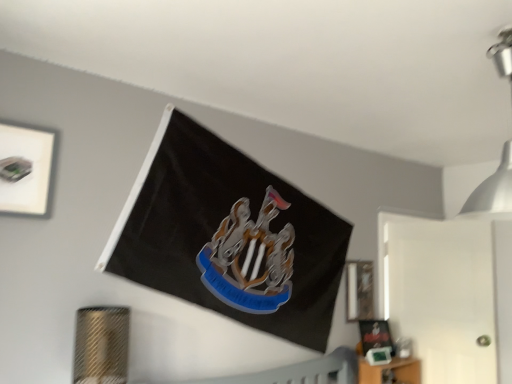
Question: From a real-world perspective, is metallic silver light fixture at upper right positioned under matte black picture frame at lower right, the second picture frame from the back, based on gravity?

Choices:
 (A) no
 (B) yes

Answer: (A)

Question: Could you tell me if metallic silver light fixture at upper right is facing matte black picture frame at lower right, which is the 2th picture frame from front to back?

Choices:
 (A) no
 (B) yes

Answer: (A)

Question: Is metallic silver light fixture at upper right next to matte black picture frame at lower right, which appears as the third picture frame when viewed from the left, and touching it?

Choices:
 (A) no
 (B) yes

Answer: (A)

Question: Is metallic silver light fixture at upper right outside matte black picture frame at lower right, which is the 2th picture frame from front to back?

Choices:
 (A) yes
 (B) no

Answer: (A)

Question: Does metallic silver light fixture at upper right have a smaller size compared to matte black picture frame at lower right, marked as the 1th picture frame in a bottom-to-top arrangement?

Choices:
 (A) yes
 (B) no

Answer: (B)

Question: Is metallic silver light fixture at upper right to the left of matte black picture frame at lower right, which appears as the third picture frame when viewed from the left, from the viewer's perspective?

Choices:
 (A) no
 (B) yes

Answer: (A)

Question: Is matte black picture frame at lower right, which appears as the third picture frame when viewed from the left, bigger than matte black picture frame at right, the 2th picture frame ordered from the bottom?

Choices:
 (A) yes
 (B) no

Answer: (A)

Question: Considering the relative sizes of matte black picture frame at lower right, marked as the 1th picture frame in a bottom-to-top arrangement, and matte black picture frame at right, positioned as the first picture frame in back-to-front order, in the image provided, is matte black picture frame at lower right, marked as the 1th picture frame in a bottom-to-top arrangement, smaller than matte black picture frame at right, positioned as the first picture frame in back-to-front order,?

Choices:
 (A) no
 (B) yes

Answer: (A)

Question: Can you confirm if matte black picture frame at lower right, the third picture frame from the top, is shorter than matte black picture frame at right, the 2th picture frame ordered from the bottom?

Choices:
 (A) yes
 (B) no

Answer: (A)

Question: From a real-world perspective, is matte black picture frame at lower right, the second picture frame from the back, located beneath matte black picture frame at right, which is the 2th picture frame in top-to-bottom order?

Choices:
 (A) yes
 (B) no

Answer: (A)

Question: From the image's perspective, is matte black picture frame at lower right, marked as the 1th picture frame in a bottom-to-top arrangement, below matte black picture frame at right, the 2th picture frame ordered from the bottom?

Choices:
 (A) yes
 (B) no

Answer: (A)

Question: Could you tell me if matte black picture frame at lower right, which appears as the third picture frame when viewed from the left, is facing matte black picture frame at right, which is the 2th picture frame in top-to-bottom order?

Choices:
 (A) no
 (B) yes

Answer: (A)

Question: Considering the relative positions of matte black picture frame at right, which is the 2th picture frame in top-to-bottom order, and metallic silver light fixture at upper right in the image provided, is matte black picture frame at right, which is the 2th picture frame in top-to-bottom order, behind metallic silver light fixture at upper right?

Choices:
 (A) no
 (B) yes

Answer: (B)